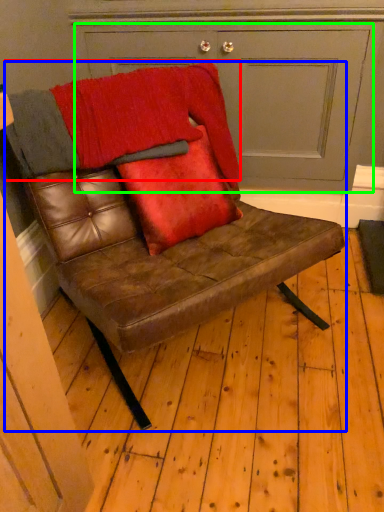
Question: Which object is positioned farthest from blanket (highlighted by a red box)? Select from chair (highlighted by a blue box) and door (highlighted by a green box).

Choices:
 (A) chair
 (B) door

Answer: (B)